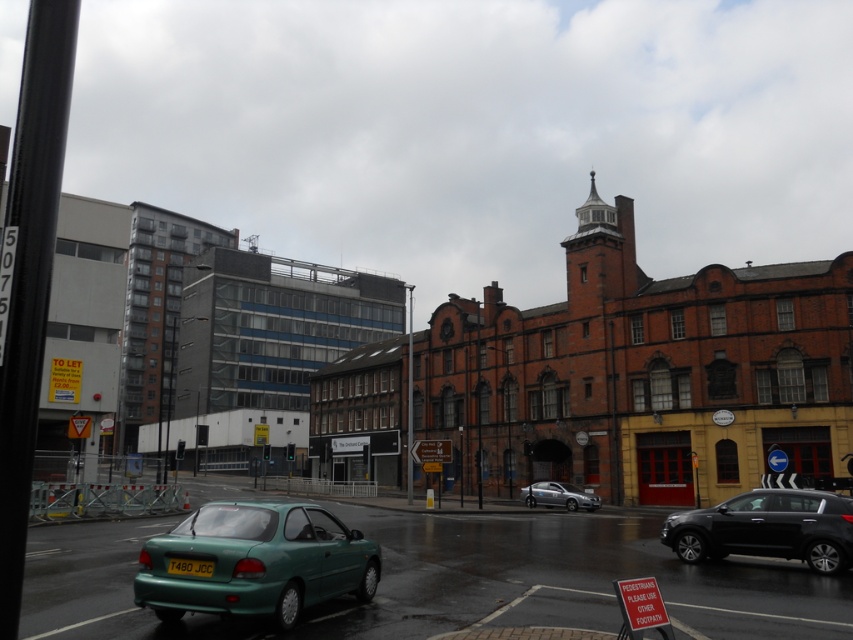
Which is above, teal glossy hatchback at center or shiny black suv at lower right?

shiny black suv at lower right

Consider the image. Can you confirm if teal glossy hatchback at center is shorter than shiny black suv at lower right?

Result: In fact, teal glossy hatchback at center may be taller than shiny black suv at lower right.

Between point (271, 611) and point (775, 509), which one is positioned behind?

Positioned behind is point (775, 509).

At what (x,y) coordinates should I click in order to perform the action: click on teal glossy hatchback at center. Please return your answer as a coordinate pair (x, y). Looking at the image, I should click on (256, 561).

Between point (755, 513) and point (190, 572), which one is positioned in front?

Positioned in front is point (190, 572).

Is shiny black suv at lower right smaller than yellow matte license plate at lower center?

No, shiny black suv at lower right is not smaller than yellow matte license plate at lower center.

Locate an element on the screen. This screenshot has height=640, width=853. shiny black suv at lower right is located at coordinates (767, 529).

Find the location of a particular element. Image resolution: width=853 pixels, height=640 pixels. shiny black suv at lower right is located at coordinates (767, 529).

How much distance is there between teal glossy hatchback at center and silver metallic sedan at center?

teal glossy hatchback at center is 26.97 meters from silver metallic sedan at center.

Does teal glossy hatchback at center have a lesser height compared to silver metallic sedan at center?

No.

Locate an element on the screen. The image size is (853, 640). teal glossy hatchback at center is located at coordinates (256, 561).